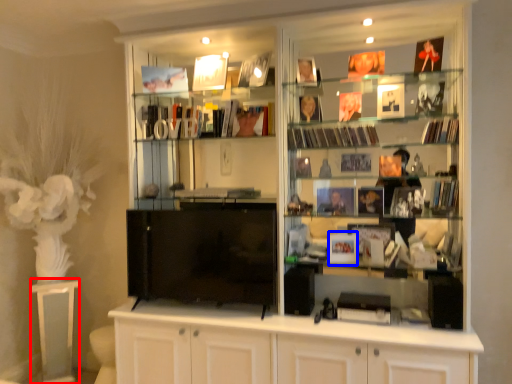
Question: Which of the following is the farthest to the observer, table (highlighted by a red box) or book (highlighted by a blue box)?

Choices:
 (A) table
 (B) book

Answer: (A)